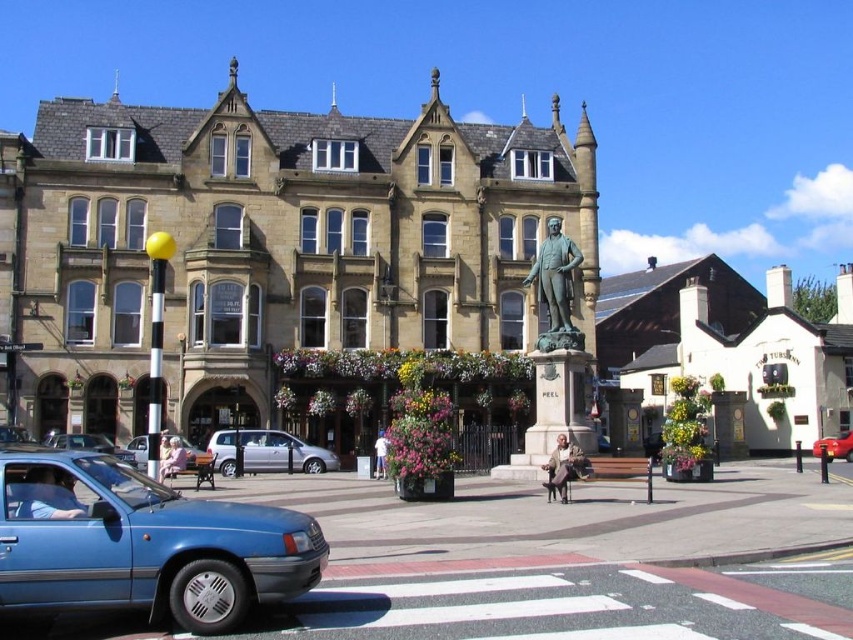
Question: Observing the image, what is the correct spatial positioning of blue metallic car at center in reference to metallic red car at center?

Choices:
 (A) above
 (B) below

Answer: (A)

Question: Which point is closer to the camera?

Choices:
 (A) blue metallic car at center
 (B) matte blue sedan at lower left

Answer: (B)

Question: Can you confirm if blue metallic car at lower left is positioned to the right of metallic red car at center?

Choices:
 (A) no
 (B) yes

Answer: (A)

Question: Which point is closer to the camera?

Choices:
 (A) metallic red car at center
 (B) bronze statue at center

Answer: (B)

Question: Is bronze statue at center smaller than metallic red car at center?

Choices:
 (A) yes
 (B) no

Answer: (B)

Question: Which of the following is the closest to the observer?

Choices:
 (A) (550, 333)
 (B) (99, 442)
 (C) (218, 456)
 (D) (827, 440)

Answer: (A)